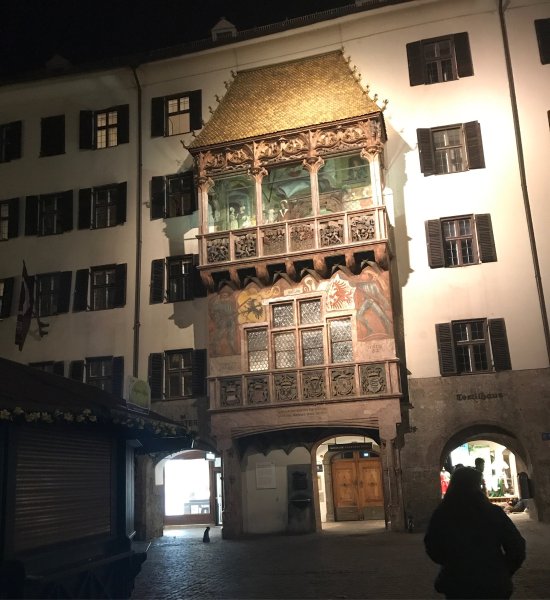
Locate an element on the screen. The width and height of the screenshot is (550, 600). windows that are lit from the inside is located at coordinates (104, 128), (181, 123).